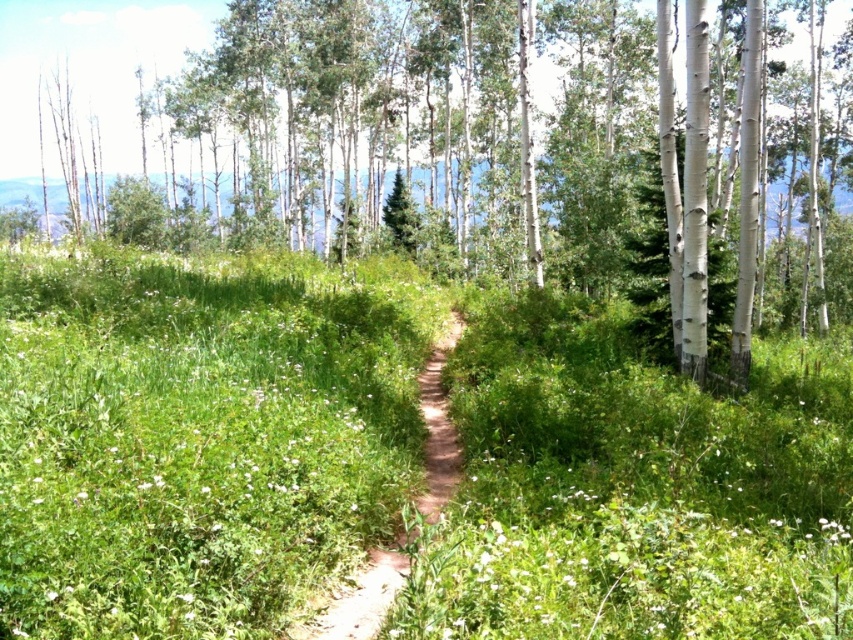
Question: Is green grassy at center above green leafy tree at center?

Choices:
 (A) no
 (B) yes

Answer: (A)

Question: Which point is farther to the camera?

Choices:
 (A) (392, 416)
 (B) (380, 557)
 (C) (822, 275)

Answer: (C)

Question: Which of the following is the closest to the observer?

Choices:
 (A) green leafy tree at center
 (B) green grassy at center
 (C) brown dirt path at center

Answer: (B)

Question: Does green leafy tree at center come behind brown dirt path at center?

Choices:
 (A) no
 (B) yes

Answer: (B)

Question: From the image, what is the correct spatial relationship of green grassy at center in relation to brown dirt path at center?

Choices:
 (A) right
 (B) left

Answer: (B)

Question: Which object appears closest to the camera in this image?

Choices:
 (A) brown dirt path at center
 (B) green grassy at center

Answer: (B)